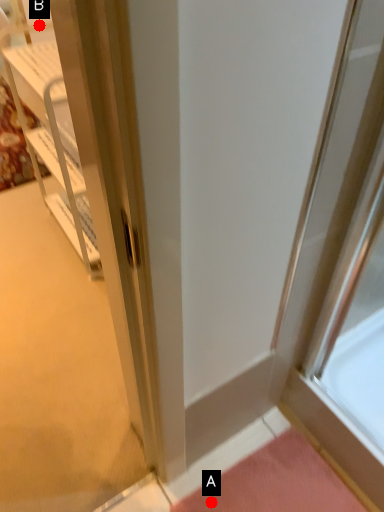
Question: Two points are circled on the image, labeled by A and B beside each circle. Which of the following is the closest to the observer?

Choices:
 (A) A is closer
 (B) B is closer

Answer: (A)